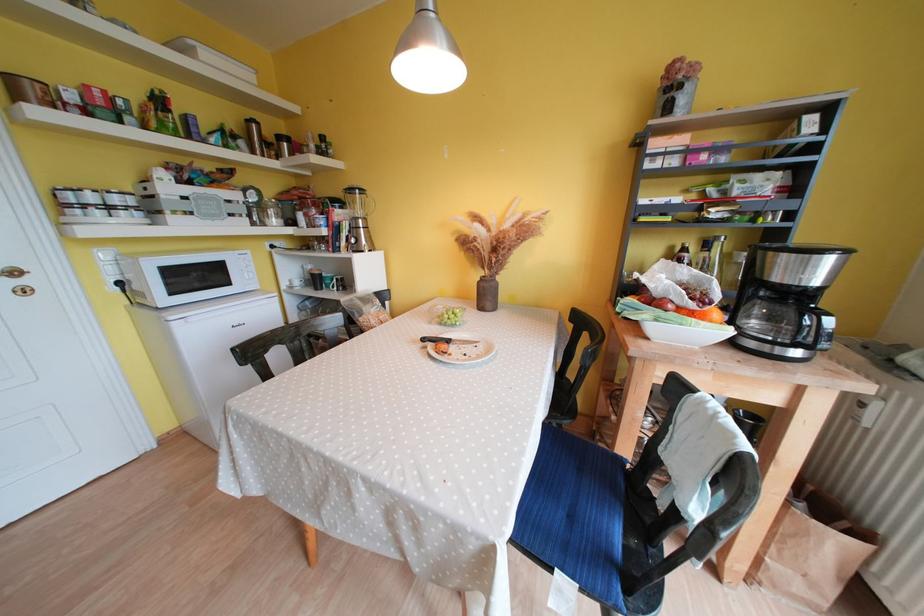
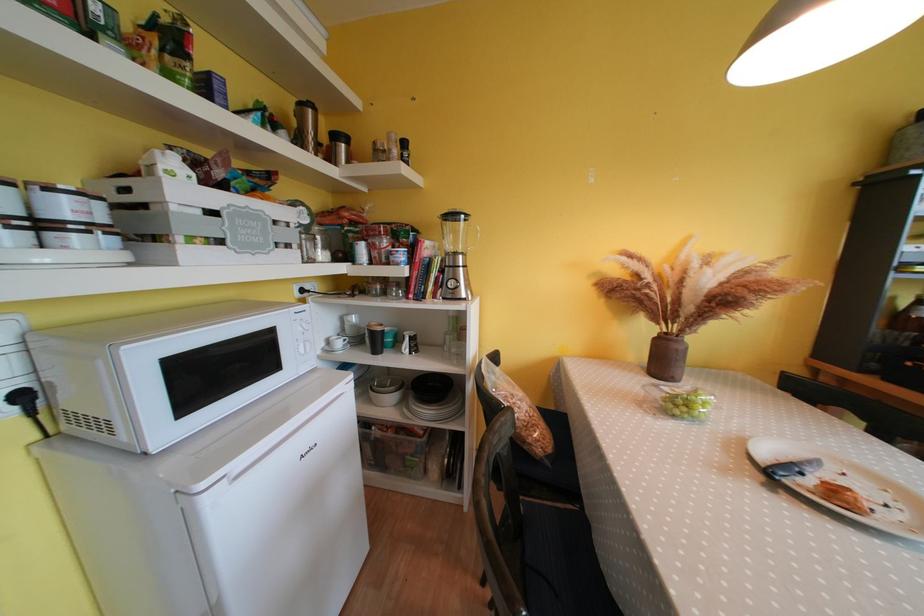
In the second image, find the point that corresponds to (304,286) in the first image.

(345, 347)